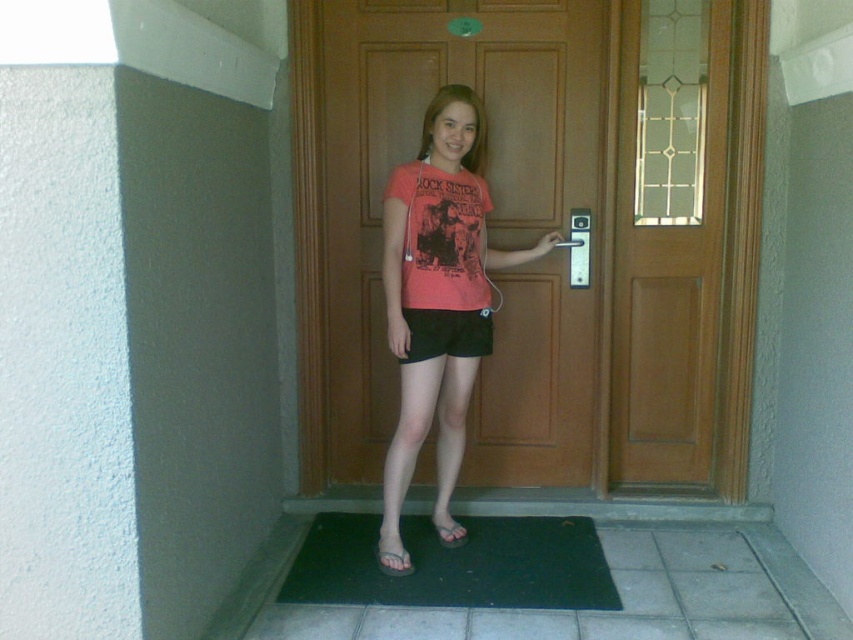
Looking at this image, you are standing in front of the image and want to describe the spatial relationship between the brown wooden door at center and the black matte shorts at center. Which object is positioned to the right of the other?

The brown wooden door at center is to the right of black matte shorts at center.

You are standing in front of the wooden door with a glass panel on the right. You notice a point at coordinates (454, 564). What object is located at this point?

The point at coordinates (454, 564) corresponds to the black rubber mat at lower center.